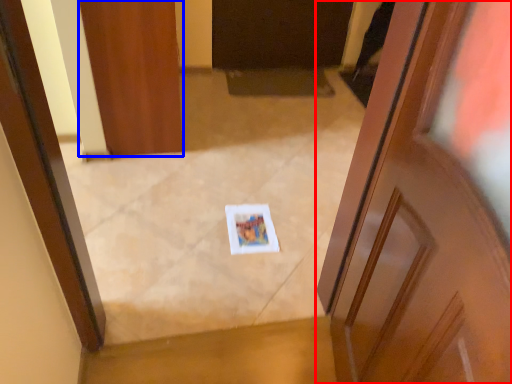
Question: Which object appears farthest to the camera in this image, door (highlighted by a red box) or door (highlighted by a blue box)?

Choices:
 (A) door
 (B) door

Answer: (B)